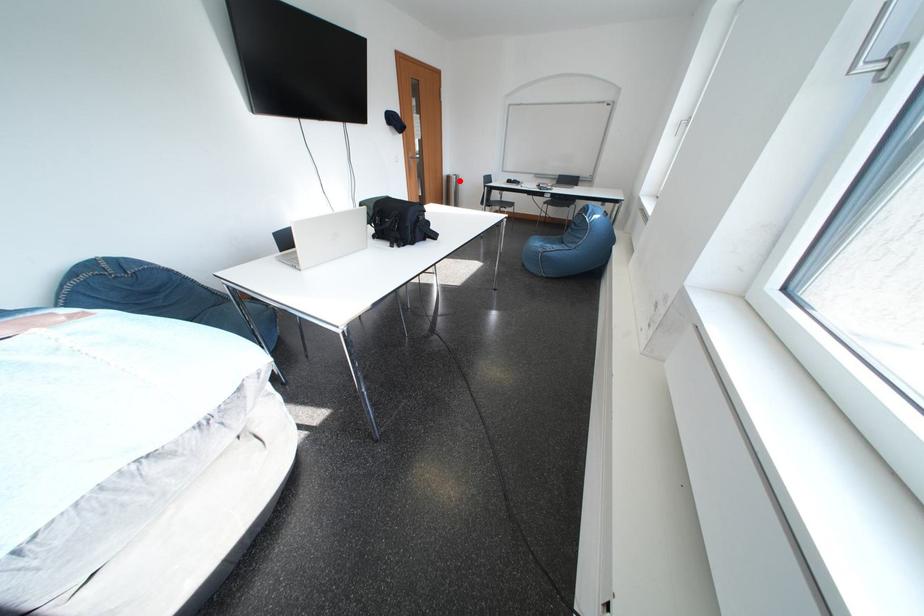
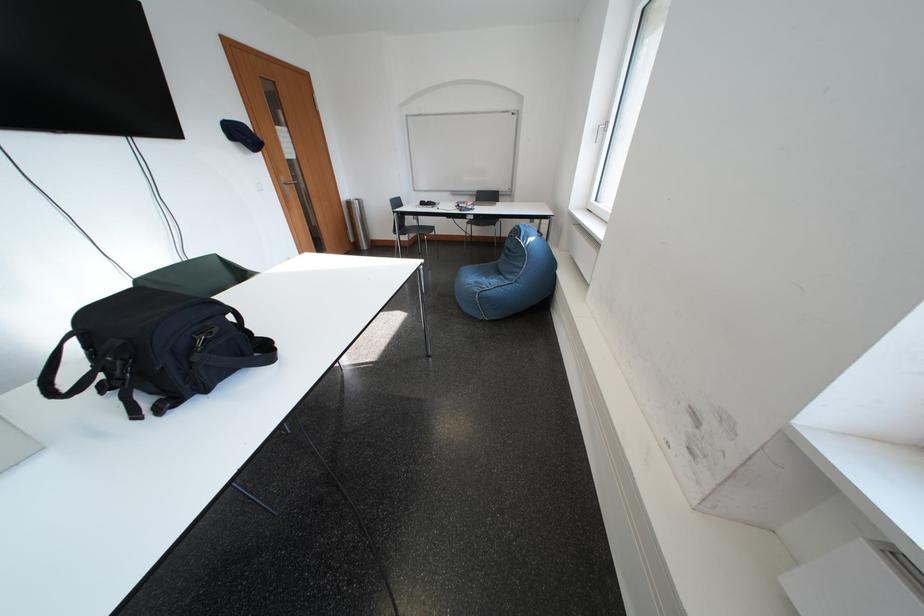
Question: A red point is marked in image1. In image2, is the corresponding 3D point closer to the camera or farther? Reply with the corresponding letter.

Choices:
 (A) The corresponding 3D point is closer.
 (B) The corresponding 3D point is farther.

Answer: (A)